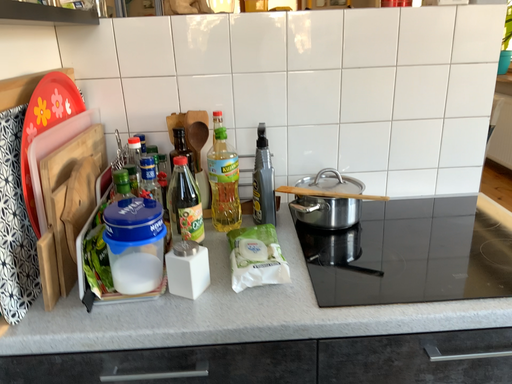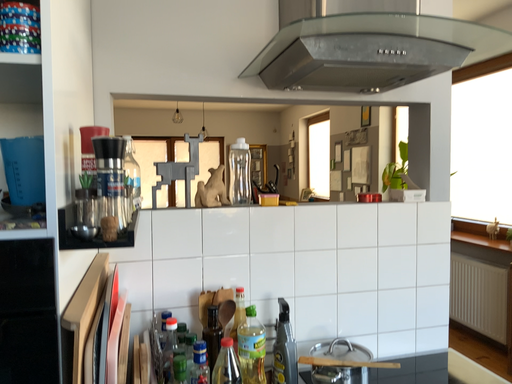
Question: Which way did the camera rotate in the video?

Choices:
 (A) rotated downward
 (B) rotated upward

Answer: (B)